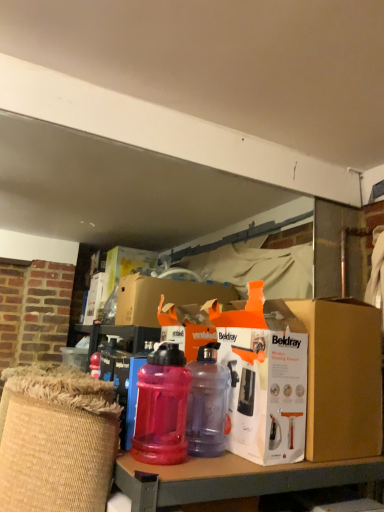
Question: Does orange cardboard box at center have a smaller size compared to translucent plastic water bottle at center, which is the second bottle from left to right?

Choices:
 (A) no
 (B) yes

Answer: (A)

Question: Can you confirm if orange cardboard box at center is taller than translucent plastic water bottle at center, placed as the first bottle when sorted from right to left?

Choices:
 (A) no
 (B) yes

Answer: (B)

Question: From a real-world perspective, is orange cardboard box at center physically below translucent plastic water bottle at center, which is the second bottle from left to right?

Choices:
 (A) yes
 (B) no

Answer: (B)

Question: Is orange cardboard box at center looking in the opposite direction of translucent plastic water bottle at center, placed as the first bottle when sorted from right to left?

Choices:
 (A) no
 (B) yes

Answer: (A)

Question: Does orange cardboard box at center appear on the right side of translucent plastic water bottle at center, placed as the first bottle when sorted from right to left?

Choices:
 (A) yes
 (B) no

Answer: (A)

Question: Is white cardboard box at center wider or thinner than orange cardboard box at center?

Choices:
 (A) wide
 (B) thin

Answer: (B)

Question: From a real-world perspective, relative to orange cardboard box at center, is white cardboard box at center vertically above or below?

Choices:
 (A) below
 (B) above

Answer: (B)

Question: From the image's perspective, relative to orange cardboard box at center, is white cardboard box at center above or below?

Choices:
 (A) above
 (B) below

Answer: (A)

Question: Would you say white cardboard box at center is to the left or to the right of orange cardboard box at center in the picture?

Choices:
 (A) right
 (B) left

Answer: (B)

Question: Is translucent plastic water bottle at center, the second bottle in the right-to-left sequence, taller or shorter than orange cardboard box at center?

Choices:
 (A) short
 (B) tall

Answer: (A)

Question: Considering the positions of translucent plastic water bottle at center, the second bottle in the right-to-left sequence, and orange cardboard box at center in the image, is translucent plastic water bottle at center, the second bottle in the right-to-left sequence, wider or thinner than orange cardboard box at center?

Choices:
 (A) wide
 (B) thin

Answer: (B)

Question: Relative to orange cardboard box at center, is translucent plastic water bottle at center, which is the first bottle from left to right, in front or behind?

Choices:
 (A) front
 (B) behind

Answer: (A)

Question: Would you say translucent plastic water bottle at center, which is the first bottle from left to right, is to the left or to the right of orange cardboard box at center in the picture?

Choices:
 (A) left
 (B) right

Answer: (A)

Question: Does point (314, 352) appear closer or farther from the camera than point (190, 413)?

Choices:
 (A) farther
 (B) closer

Answer: (A)

Question: Is orange cardboard box at center wider or thinner than translucent plastic water bottle at center, placed as the first bottle when sorted from right to left?

Choices:
 (A) wide
 (B) thin

Answer: (A)